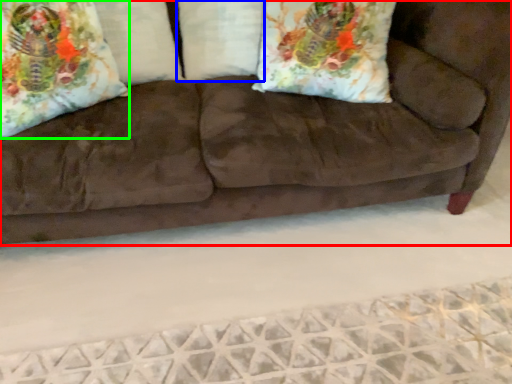
Question: Based on their relative distances, which object is farther from studio couch (highlighted by a red box)? Choose from pillow (highlighted by a blue box) and throw pillow (highlighted by a green box).

Choices:
 (A) pillow
 (B) throw pillow

Answer: (B)